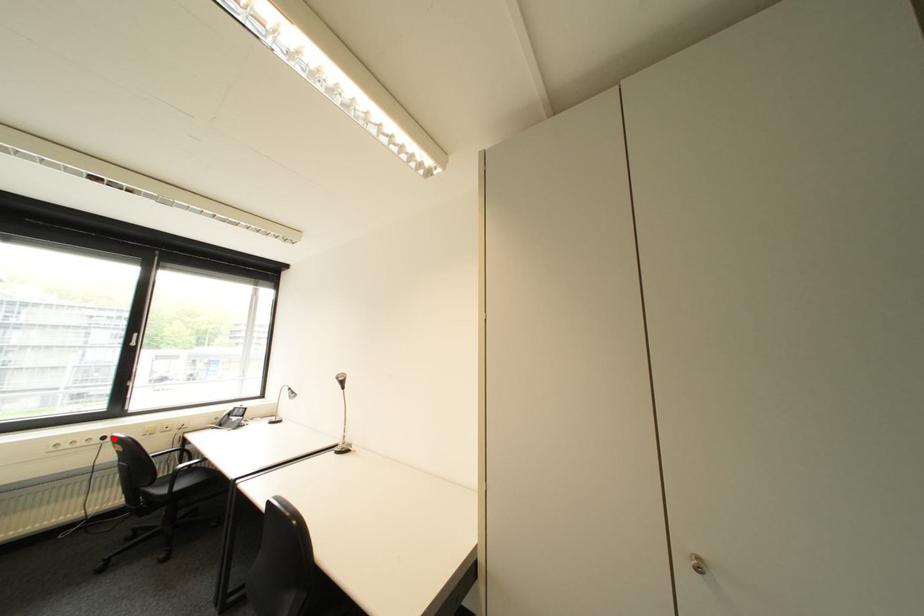
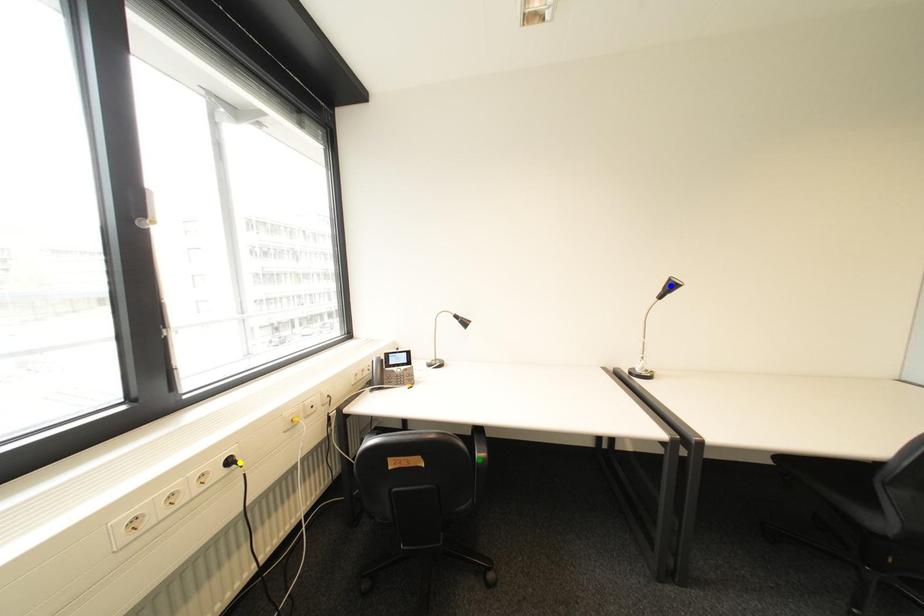
Question: I am providing you with two images of the same scene from different viewpoints. A red point is marked on the first image. You are given multiple points on the second image. In image 2, which mark is for the same physical point as the one in image 1?

Choices:
 (A) blue point
 (B) green point
 (C) yellow point

Answer: (C)